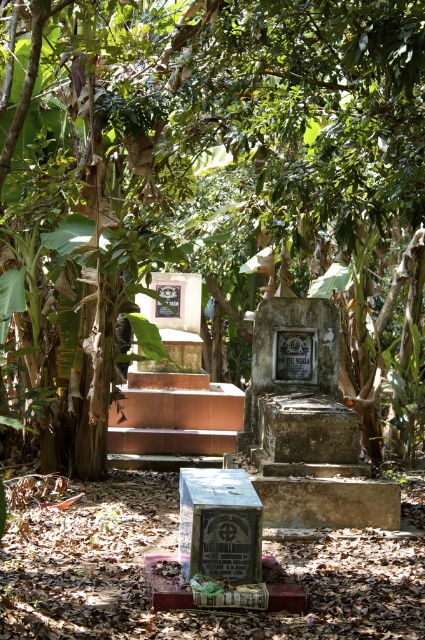
Does brown concrete stairs at center appear over metallic stone gravestone at center?

Yes.

Who is shorter, brown concrete stairs at center or metallic stone gravestone at center?

metallic stone gravestone at center is shorter.

Does point (187, 445) come farther from viewer compared to point (183, 541)?

Yes, it is behind point (183, 541).

Image resolution: width=425 pixels, height=640 pixels. I want to click on brown concrete stairs at center, so click(x=173, y=424).

Is point (322, 358) behind point (178, 426)?

No, it is not.

Does weathered stone plaque at center have a lesser width compared to brown concrete stairs at center?

Indeed, weathered stone plaque at center has a lesser width compared to brown concrete stairs at center.

Measure the distance between weathered stone plaque at center and camera.

The distance of weathered stone plaque at center from camera is 21.30 feet.

This screenshot has height=640, width=425. Identify the location of weathered stone plaque at center. (299, 385).

Is brown concrete stairs at center above matte black plaque at center?

No.

Does brown concrete stairs at center appear on the right side of matte black plaque at center?

In fact, brown concrete stairs at center is to the left of matte black plaque at center.

Is point (153, 449) farther from viewer compared to point (308, 342)?

Yes, it is.

The image size is (425, 640). I want to click on brown concrete stairs at center, so click(x=173, y=424).